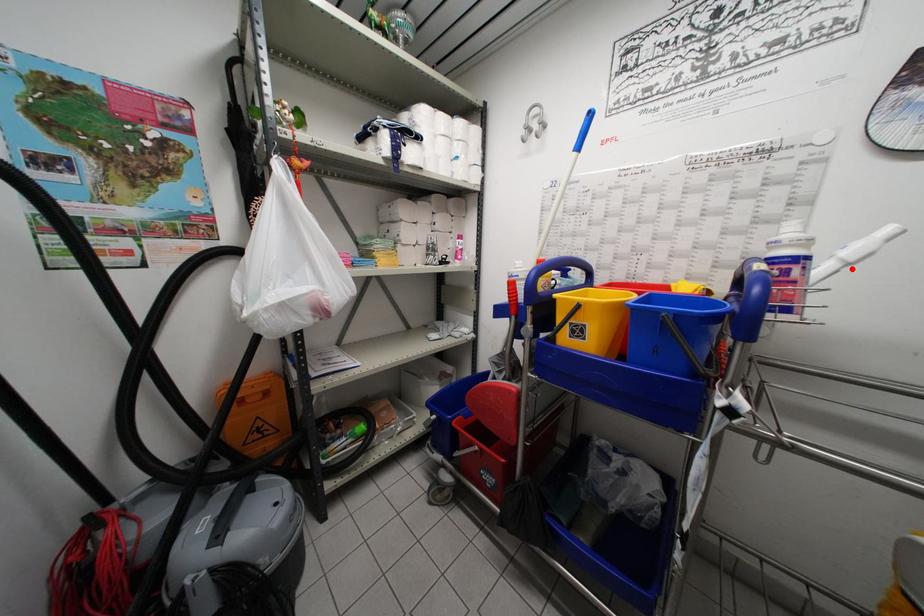
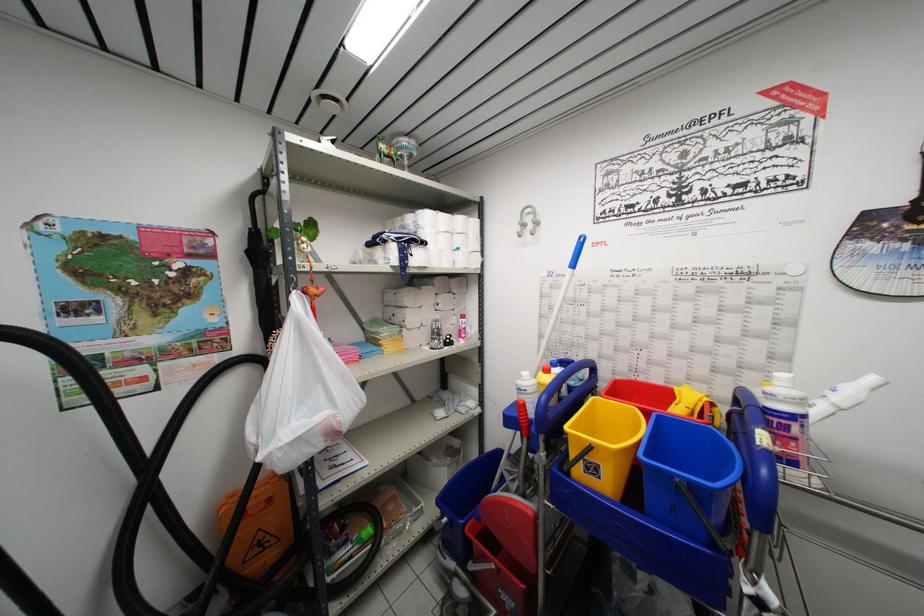
In the second image, find the point that corresponds to the highlighted location in the first image.

(845, 415)